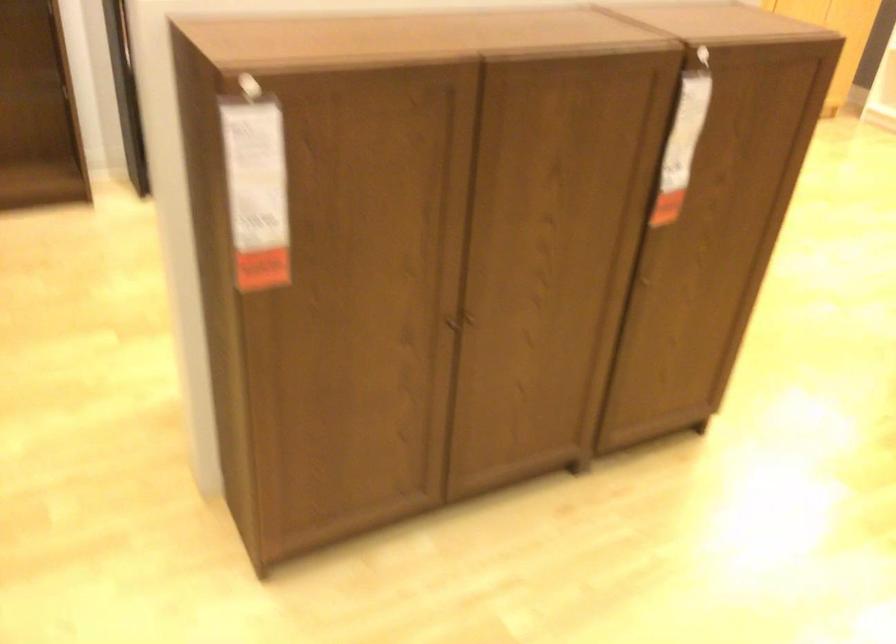
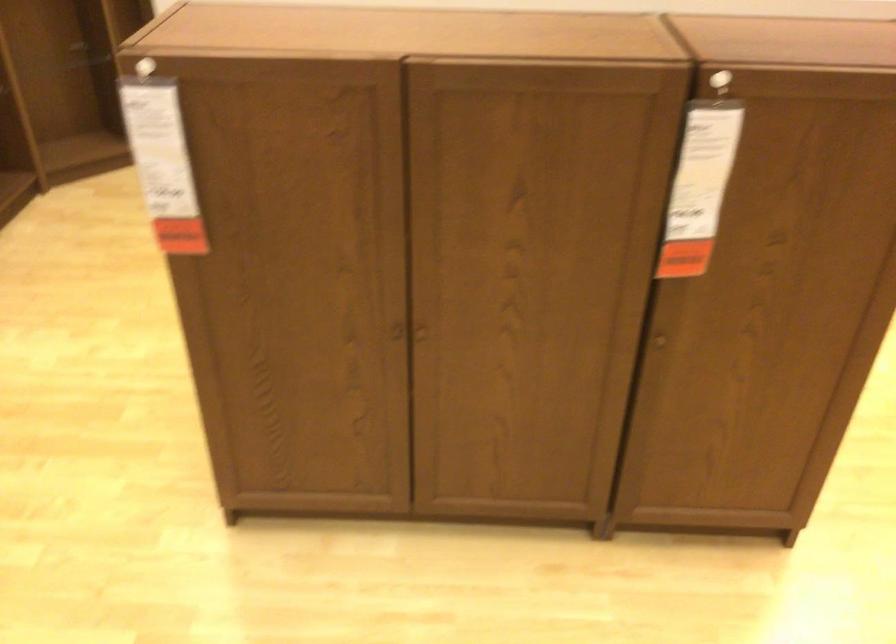
Where in the second image is the point corresponding to point (239, 196) from the first image?

(162, 164)